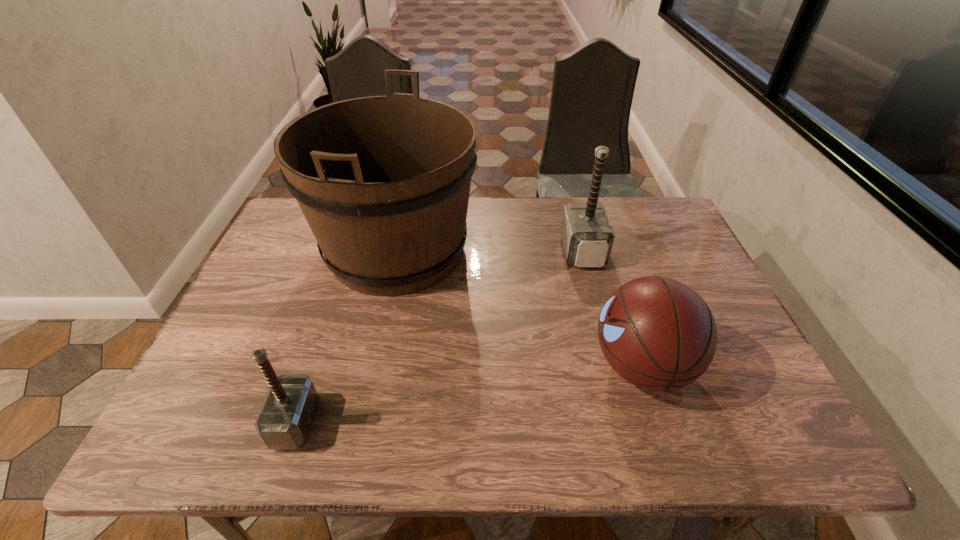
Identify the location of vacant region located 0.360m on the left of the basketball. The width and height of the screenshot is (960, 540). (432, 366).

Identify the location of vacant space located 0.340m on the back of the left hammer. (341, 285).

Where is `bucket at the far edge`? The height and width of the screenshot is (540, 960). bucket at the far edge is located at coordinates (383, 181).

You are a GUI agent. You are given a task and a screenshot of the screen. Output one action in this format:
    pyautogui.click(x=<x>, y=<y>)
    Task: Click on the hammer present at the far edge
    
    Given the screenshot: What is the action you would take?
    pyautogui.click(x=587, y=236)

Identify the location of basketball that is at the near edge. click(657, 333).

The height and width of the screenshot is (540, 960). I want to click on hammer located at the near edge, so click(x=285, y=419).

This screenshot has height=540, width=960. I want to click on object that is at the left edge, so [383, 181].

Where is `object that is at the right edge`? This screenshot has height=540, width=960. object that is at the right edge is located at coordinates (657, 333).

This screenshot has height=540, width=960. Identify the location of object at the far left corner. (383, 181).

Find the location of a particular element. This screenshot has width=960, height=540. object that is at the near right corner is located at coordinates (657, 333).